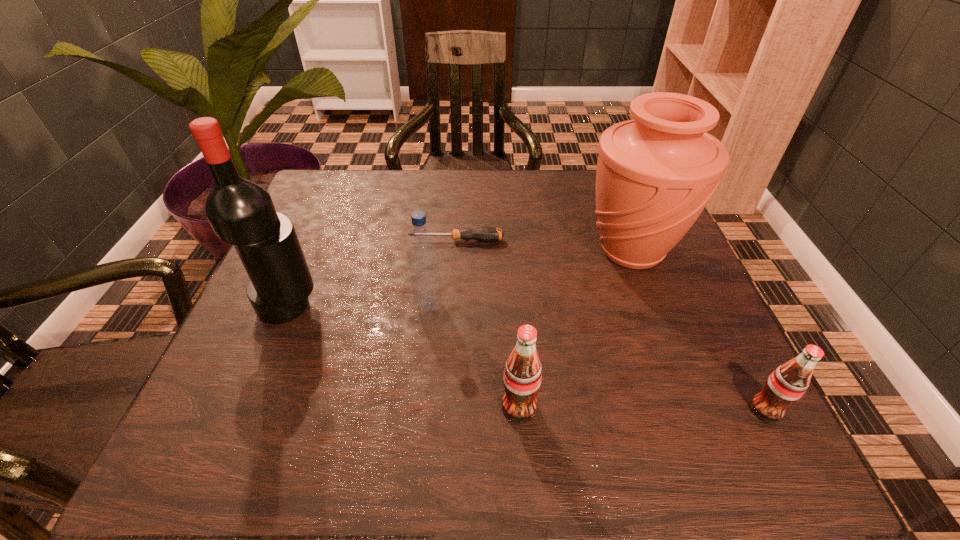
Image resolution: width=960 pixels, height=540 pixels. What are the coordinates of `free location located on the front of the shortest object` in the screenshot? It's located at (454, 271).

Locate an element on the screen. The width and height of the screenshot is (960, 540). vacant space located on the back of the vase is located at coordinates (613, 204).

I want to click on free space located 0.100m on the back of the water bottle, so click(x=433, y=262).

The image size is (960, 540). Identify the location of vacant space situated on the right of the wine bottle. (388, 307).

Locate an element on the screen. The height and width of the screenshot is (540, 960). object located at the far edge is located at coordinates click(x=655, y=174).

The height and width of the screenshot is (540, 960). I want to click on object located at the left edge, so click(x=241, y=212).

Where is `soda that is at the right edge`? Image resolution: width=960 pixels, height=540 pixels. soda that is at the right edge is located at coordinates (787, 384).

This screenshot has width=960, height=540. In order to click on vase that is at the right edge in this screenshot , I will do 655,174.

Locate an element on the screen. The height and width of the screenshot is (540, 960). object that is positioned at the far right corner is located at coordinates (655, 174).

Image resolution: width=960 pixels, height=540 pixels. I want to click on object at the near right corner, so click(x=787, y=384).